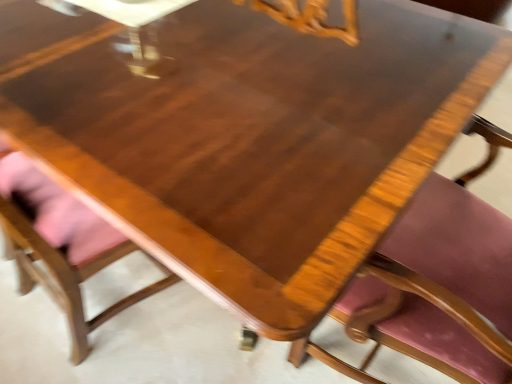
Question: Considering the positions of wooden chair with pink cushion at lower left, which ranks as the 1th chair in left-to-right order, and wooden chair with pink cushion at center, which is the 1th chair from right to left, in the image, is wooden chair with pink cushion at lower left, which ranks as the 1th chair in left-to-right order, wider or thinner than wooden chair with pink cushion at center, which is the 1th chair from right to left,?

Choices:
 (A) thin
 (B) wide

Answer: (A)

Question: In terms of height, does wooden chair with pink cushion at lower left, which ranks as the 1th chair in left-to-right order, look taller or shorter compared to wooden chair with pink cushion at center, which is the 1th chair from right to left?

Choices:
 (A) short
 (B) tall

Answer: (A)

Question: From a real-world perspective, is wooden chair with pink cushion at lower left, which ranks as the 1th chair in left-to-right order, physically located above or below wooden chair with pink cushion at center, which is the 1th chair from right to left?

Choices:
 (A) below
 (B) above

Answer: (A)

Question: Is point (501, 374) positioned closer to the camera than point (46, 193)?

Choices:
 (A) closer
 (B) farther

Answer: (A)

Question: Considering the positions of wooden chair with pink cushion at center, which is the 1th chair from right to left, and wooden chair with pink cushion at lower left, which ranks as the 1th chair in left-to-right order, in the image, is wooden chair with pink cushion at center, which is the 1th chair from right to left, taller or shorter than wooden chair with pink cushion at lower left, which ranks as the 1th chair in left-to-right order,?

Choices:
 (A) tall
 (B) short

Answer: (A)

Question: From a real-world perspective, is wooden chair with pink cushion at center, which is the 1th chair from right to left, physically located above or below wooden chair with pink cushion at lower left, marked as the 2th chair in a right-to-left arrangement?

Choices:
 (A) above
 (B) below

Answer: (A)

Question: Considering their positions, is wooden chair with pink cushion at center, which ranks as the second chair in left-to-right order, located in front of or behind wooden chair with pink cushion at lower left, marked as the 2th chair in a right-to-left arrangement?

Choices:
 (A) behind
 (B) front

Answer: (B)